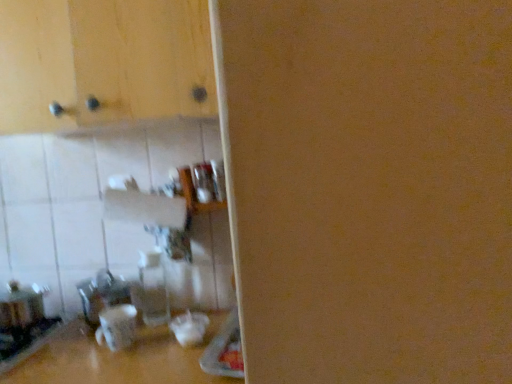
Find the location of `matte wood cabinet at upper left`. matte wood cabinet at upper left is located at coordinates (103, 63).

This screenshot has height=384, width=512. Find the location of `transparent glass bottle at center`. transparent glass bottle at center is located at coordinates (154, 290).

Find the location of a particular element. metallic silver toaster at lower left is located at coordinates (21, 305).

How distant is metallic silver toaster at lower left from matte wood cabinet at upper left?

The distance of metallic silver toaster at lower left from matte wood cabinet at upper left is 30.56 inches.

Are metallic silver toaster at lower left and matte wood cabinet at upper left beside each other?

No, metallic silver toaster at lower left is not next to matte wood cabinet at upper left.

Is metallic silver toaster at lower left to the right of matte wood cabinet at upper left from the viewer's perspective?

Incorrect, metallic silver toaster at lower left is not on the right side of matte wood cabinet at upper left.

Does metallic silver toaster at lower left have a greater height compared to matte wood cabinet at upper left?

No, metallic silver toaster at lower left is not taller than matte wood cabinet at upper left.

Is transparent glass bottle at center further to the viewer compared to metallic silver toaster at lower left?

Yes, it is.

From the image's perspective, is transparent glass bottle at center below metallic silver toaster at lower left?

Actually, transparent glass bottle at center appears above metallic silver toaster at lower left in the image.

Based on the photo, is metallic silver toaster at lower left completely or partially inside transparent glass bottle at center?

Definitely not — metallic silver toaster at lower left is not inside transparent glass bottle at center.

Can you tell me how much transparent glass bottle at center and metallic silver toaster at lower left differ in facing direction?

0.403 degrees.

How much distance is there between matte wood cabinet at upper left and transparent glass bottle at center?

They are 26.99 inches apart.

What's the angular difference between matte wood cabinet at upper left and transparent glass bottle at center's facing directions?

They differ by 1.23 degrees in their facing directions.

Is matte wood cabinet at upper left next to transparent glass bottle at center and touching it?

No, matte wood cabinet at upper left is not in contact with transparent glass bottle at center.

Does matte wood cabinet at upper left turn towards transparent glass bottle at center?

No, matte wood cabinet at upper left is not oriented towards transparent glass bottle at center.

Is metallic silver toaster at lower left aimed at transparent glass bottle at center?

No, metallic silver toaster at lower left is not turned towards transparent glass bottle at center.

Considering the sizes of objects metallic silver toaster at lower left and transparent glass bottle at center in the image provided, who is bigger, metallic silver toaster at lower left or transparent glass bottle at center?

With larger size is metallic silver toaster at lower left.

From the image's perspective, who appears lower, metallic silver toaster at lower left or transparent glass bottle at center?

metallic silver toaster at lower left appears lower in the image.

From a real-world perspective, who is located higher, metallic silver toaster at lower left or transparent glass bottle at center?

transparent glass bottle at center.

Considering the relative sizes of transparent glass bottle at center and matte wood cabinet at upper left in the image provided, is transparent glass bottle at center shorter than matte wood cabinet at upper left?

Correct, transparent glass bottle at center is not as tall as matte wood cabinet at upper left.

Can you confirm if transparent glass bottle at center is thinner than matte wood cabinet at upper left?

Yes, transparent glass bottle at center is thinner than matte wood cabinet at upper left.

From a real-world perspective, which is physically above, transparent glass bottle at center or matte wood cabinet at upper left?

A: matte wood cabinet at upper left is physically above.

In terms of width, does matte wood cabinet at upper left look wider or thinner when compared to metallic silver toaster at lower left?

matte wood cabinet at upper left is wider than metallic silver toaster at lower left.

Considering the relative positions of matte wood cabinet at upper left and metallic silver toaster at lower left in the image provided, is matte wood cabinet at upper left in front of metallic silver toaster at lower left?

Yes, it is.

From a real-world perspective, is matte wood cabinet at upper left over metallic silver toaster at lower left?

Correct, in the physical world, matte wood cabinet at upper left is higher than metallic silver toaster at lower left.

Do you think matte wood cabinet at upper left is within metallic silver toaster at lower left, or outside of it?

matte wood cabinet at upper left is outside metallic silver toaster at lower left.

I want to click on appliance to the left of matte wood cabinet at upper left, so point(21,305).

I want to click on appliance that is under the transparent glass bottle at center (from a real-world perspective), so click(x=21, y=305).

Based on the photo, looking at the image, which one is located closer to metallic silver toaster at lower left, transparent glass bottle at center or matte wood cabinet at upper left?

transparent glass bottle at center lies closer to metallic silver toaster at lower left than the other object.

Which object lies nearer to the anchor point matte wood cabinet at upper left, transparent glass bottle at center or metallic silver toaster at lower left?

transparent glass bottle at center is closer to matte wood cabinet at upper left.

When comparing their distances from metallic silver toaster at lower left, does matte wood cabinet at upper left or transparent glass bottle at center seem closer?

transparent glass bottle at center.

Estimate the real-world distances between objects in this image. Which object is further from matte wood cabinet at upper left, metallic silver toaster at lower left or transparent glass bottle at center?

Based on the image, metallic silver toaster at lower left appears to be further to matte wood cabinet at upper left.

Estimate the real-world distances between objects in this image. Which object is closer to transparent glass bottle at center, matte wood cabinet at upper left or metallic silver toaster at lower left?

metallic silver toaster at lower left.

When comparing their distances from transparent glass bottle at center, does metallic silver toaster at lower left or matte wood cabinet at upper left seem closer?

metallic silver toaster at lower left lies closer to transparent glass bottle at center than the other object.

You are a GUI agent. You are given a task and a screenshot of the screen. Output one action in this format:
    pyautogui.click(x=<x>, y=<y>)
    Task: Click on the bottle that lies between matte wood cabinet at upper left and metallic silver toaster at lower left from top to bottom
    This screenshot has height=384, width=512.
    Given the screenshot: What is the action you would take?
    pyautogui.click(x=154, y=290)